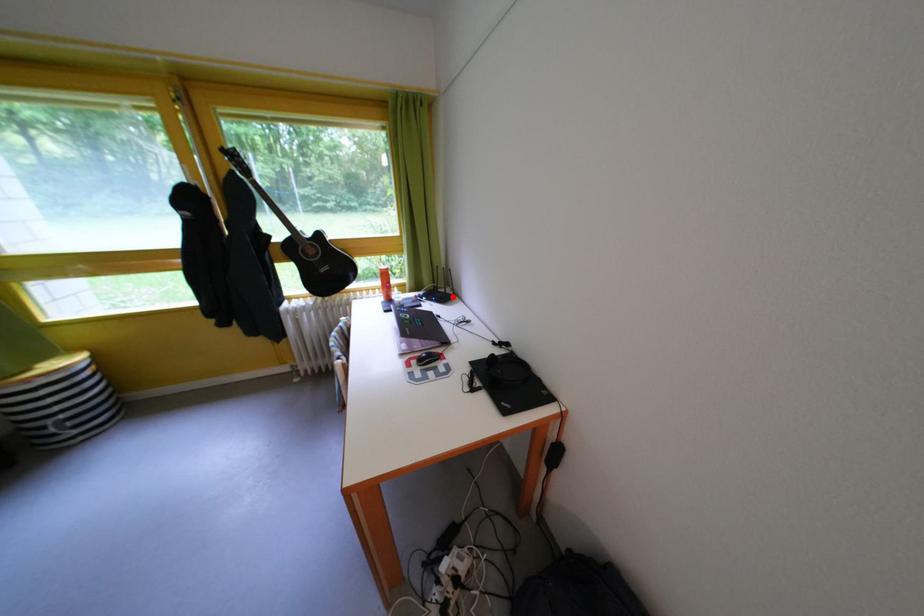
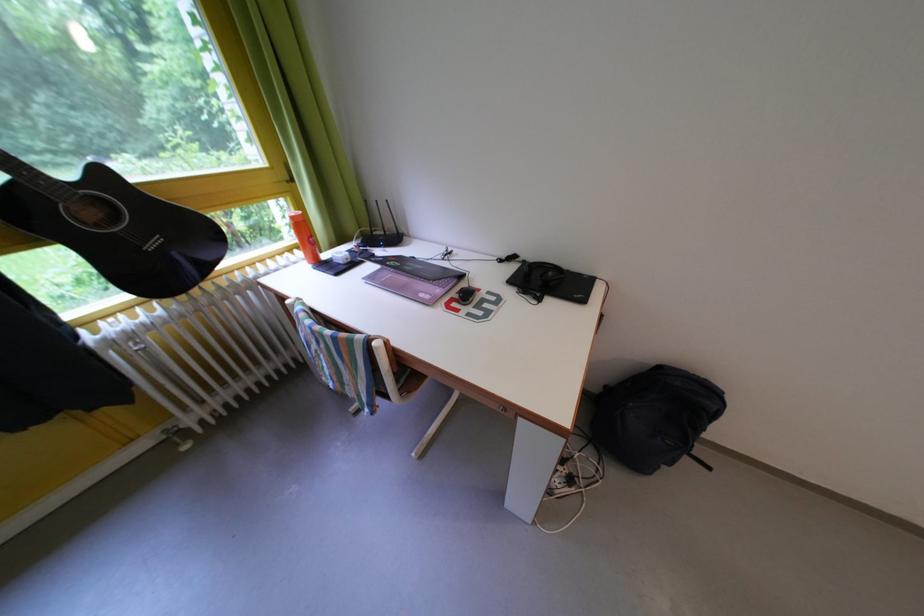
Locate, in the second image, the point that corresponds to the highlighted location in the first image.

(392, 238)